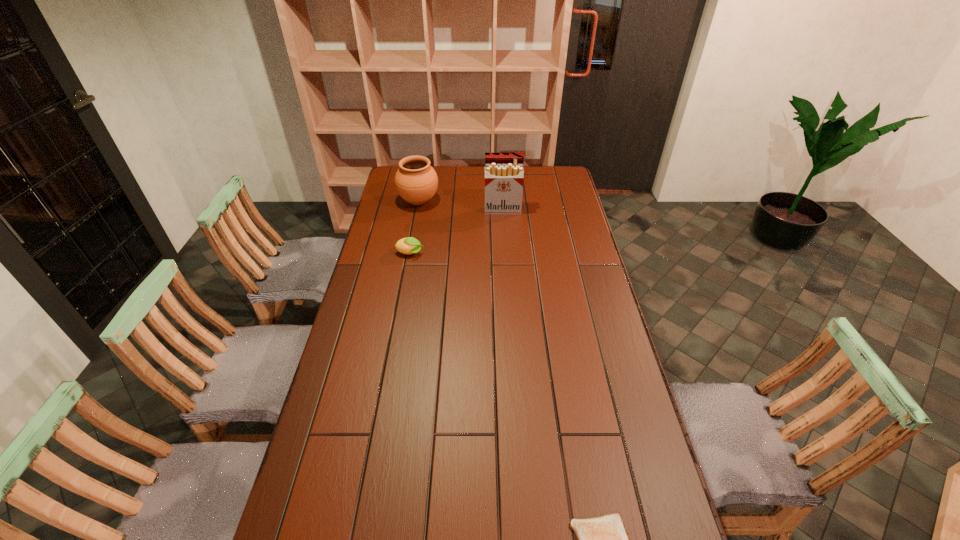
Image resolution: width=960 pixels, height=540 pixels. Identify the location of blank space at the far edge of the desktop. (468, 181).

Where is `vacant space at the left edge`? This screenshot has height=540, width=960. vacant space at the left edge is located at coordinates (355, 504).

Locate an element on the screen. free spot at the right edge of the desktop is located at coordinates (578, 331).

The height and width of the screenshot is (540, 960). In the image, there is a desktop. In order to click on vacant space at the far right corner in this screenshot , I will do coord(540,181).

The width and height of the screenshot is (960, 540). Identify the location of vacant area that lies between the third shortest object and the third farthest object. (414, 227).

Where is `vacant area that lies between the lemon and the pottery`? vacant area that lies between the lemon and the pottery is located at coordinates (414, 227).

What are the coordinates of `blank region between the second tallest object and the third farthest object` in the screenshot? It's located at (414, 227).

You are a GUI agent. You are given a task and a screenshot of the screen. Output one action in this format:
    pyautogui.click(x=<x>, y=<y>)
    Task: Click on the free space between the second nearest object and the cigarette case
    Image resolution: width=960 pixels, height=540 pixels.
    Given the screenshot: What is the action you would take?
    pyautogui.click(x=456, y=232)

Identify the location of free spot between the second nearest object and the second tallest object. (414, 227).

The image size is (960, 540). What are the coordinates of `free spot between the lemon and the tallest object` in the screenshot? It's located at (456, 232).